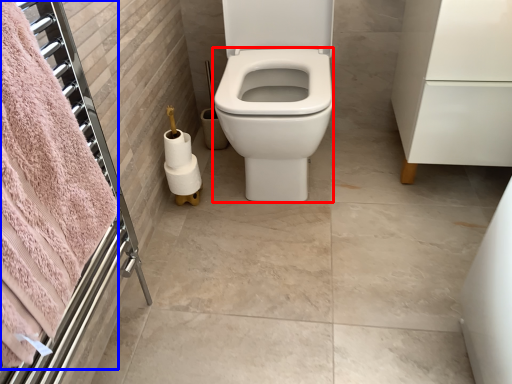
Question: Among these objects, which one is farthest to the camera, bidet (highlighted by a red box) or bath towel (highlighted by a blue box)?

Choices:
 (A) bidet
 (B) bath towel

Answer: (A)